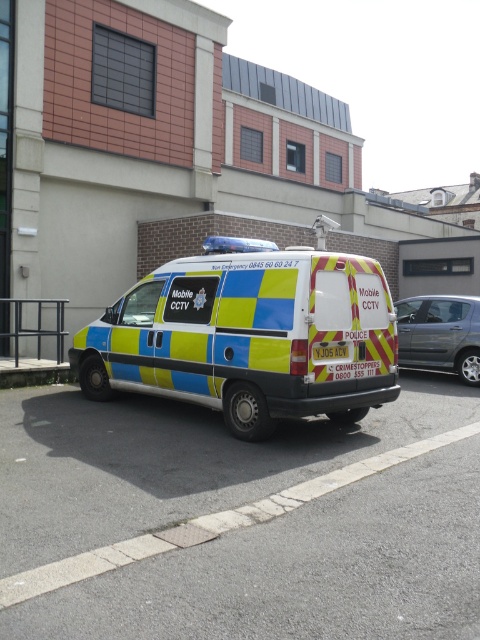
Question: Which point appears farthest from the camera in this image?

Choices:
 (A) (326, 292)
 (B) (432, 326)

Answer: (B)

Question: Among these points, which one is nearest to the camera?

Choices:
 (A) (205, 248)
 (B) (456, 304)

Answer: (A)

Question: Is yellow and blue checkered van at center to the right of metallic silver car at right from the viewer's perspective?

Choices:
 (A) yes
 (B) no

Answer: (B)

Question: Does yellow and blue checkered van at center have a smaller size compared to metallic silver car at right?

Choices:
 (A) no
 (B) yes

Answer: (A)

Question: Can you confirm if yellow and blue checkered van at center is smaller than metallic silver car at right?

Choices:
 (A) no
 (B) yes

Answer: (A)